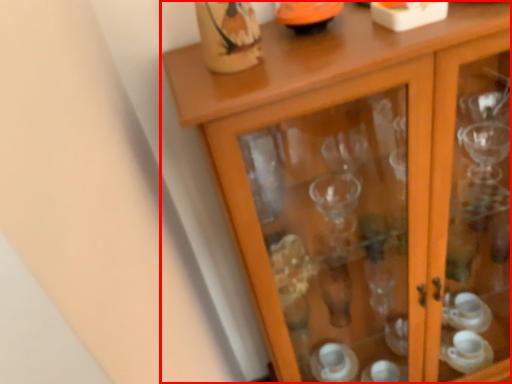
Question: Where is cupboard (annotated by the red box) located in relation to tableware in the image?

Choices:
 (A) left
 (B) right

Answer: (B)